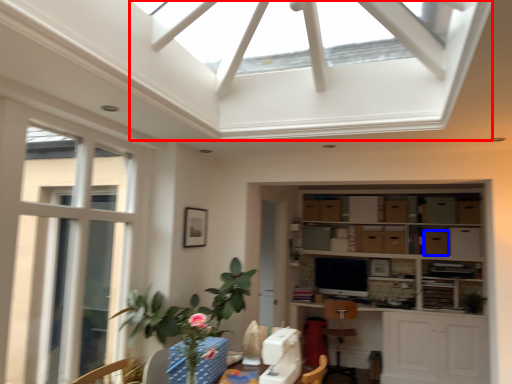
Question: Which of the following is the closest to the observer, exhaust hood (highlighted by a red box) or cabinetry (highlighted by a blue box)?

Choices:
 (A) exhaust hood
 (B) cabinetry

Answer: (A)